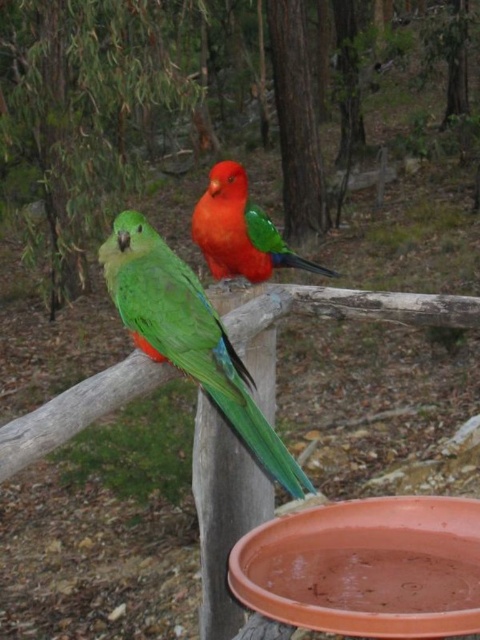
You are a birdwatcher standing in the forest and see the green glossy parrot at left. If you want to take a photo of it, where should you position yourself relative to the wooden structure?

The green glossy parrot at left is positioned at coordinates point (189, 337) on the wooden structure. To take a clear photo, you should position yourself directly in front of this point to capture the bird effectively.

You are a birdwatcher trying to take a photo of both the green glossy parrot at left and the shiny orange parrot at center. Since you want to ensure both are in focus, you need to know their relative positions. Which parrot is closer to the camera?

The green glossy parrot at left is in front of the shiny orange parrot at center, so it is closer to the camera.

You are standing in a forest and see the green glossy parrot at left. If you want to take a photo of it with your camera that has a maximum focus range of 6 feet, will you be able to capture it clearly?

The green glossy parrot at left and viewer are 6.05 feet apart from each other. Since the camera can only focus up to 6 feet, you are slightly out of range and the photo may not be clear.